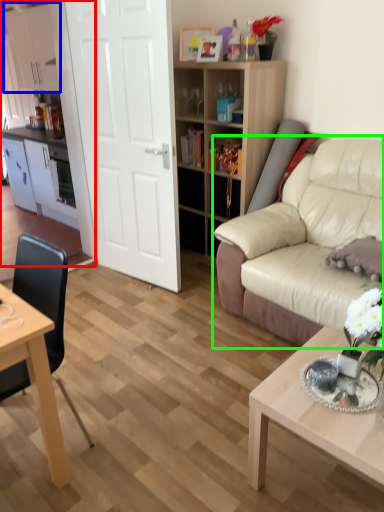
Question: Based on their relative distances, which object is nearer to entertainment center (highlighted by a red box)? Choose from cabinetry (highlighted by a blue box) and studio couch (highlighted by a green box).

Choices:
 (A) cabinetry
 (B) studio couch

Answer: (A)